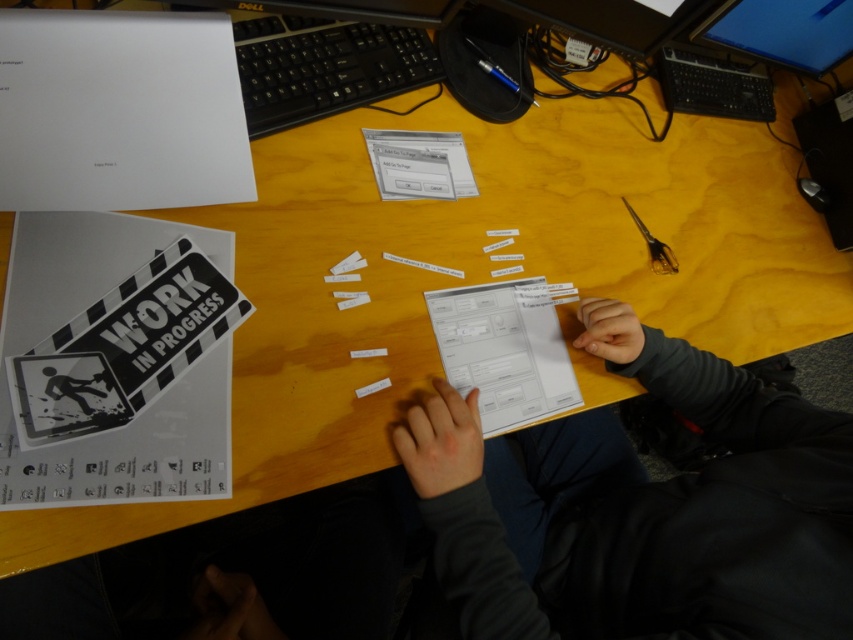
Question: Observing the image, what is the correct spatial positioning of white matte sign at lower left in reference to black plastic keyboard at upper center?

Choices:
 (A) above
 (B) below

Answer: (B)

Question: Is white matte sign at lower left further to camera compared to black glossy poster at center?

Choices:
 (A) yes
 (B) no

Answer: (B)

Question: Is white matte sign at lower left to the right of black glossy poster at center from the viewer's perspective?

Choices:
 (A) no
 (B) yes

Answer: (B)

Question: Which of the following is the closest to the observer?

Choices:
 (A) white matte sign at lower left
 (B) black plastic keyboard at upper center
 (C) dark gray sweater at center
 (D) black glossy poster at center

Answer: (C)

Question: Among these objects, which one is farthest from the camera?

Choices:
 (A) white matte sign at lower left
 (B) matte black monitor at upper right
 (C) black glossy poster at center

Answer: (B)

Question: Which of the following is the farthest from the observer?

Choices:
 (A) (88, 356)
 (B) (148, 461)
 (C) (775, 61)
 (D) (325, 19)

Answer: (C)